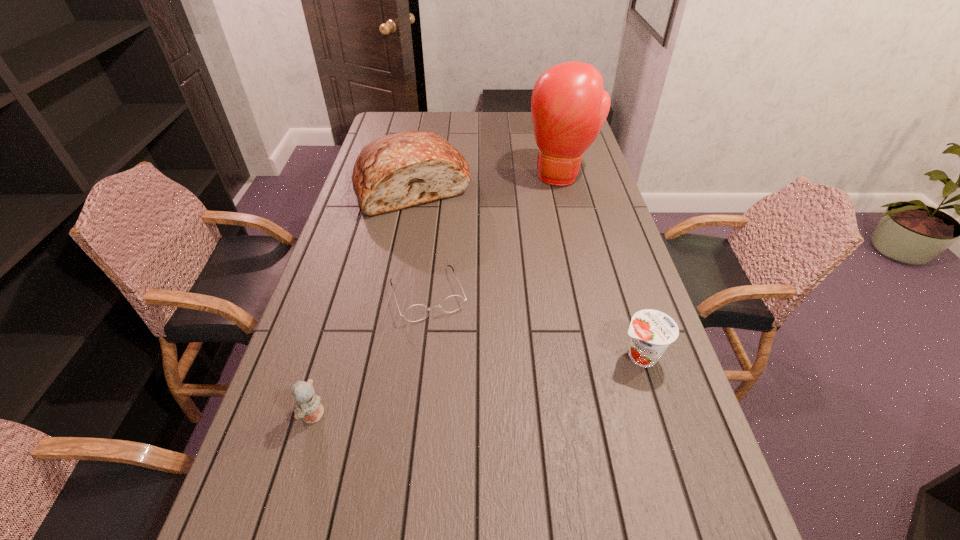
Locate an element on the screen. vacant space on the desktop that is between the nearest object and the second nearest object and is positioned on the front-facing side of the shortest object is located at coordinates (463, 388).

At what (x,y) coordinates should I click in order to perform the action: click on vacant spot on the desktop that is between the nearest object and the fourth farthest object and is positioned at the sliced front of the second tallest object. Please return your answer as a coordinate pair (x, y). Looking at the image, I should click on (492, 383).

The width and height of the screenshot is (960, 540). I want to click on vacant spot on the desktop that is between the teddy bear and the yogurt and is positioned on the striking surface of the tallest object, so click(x=499, y=381).